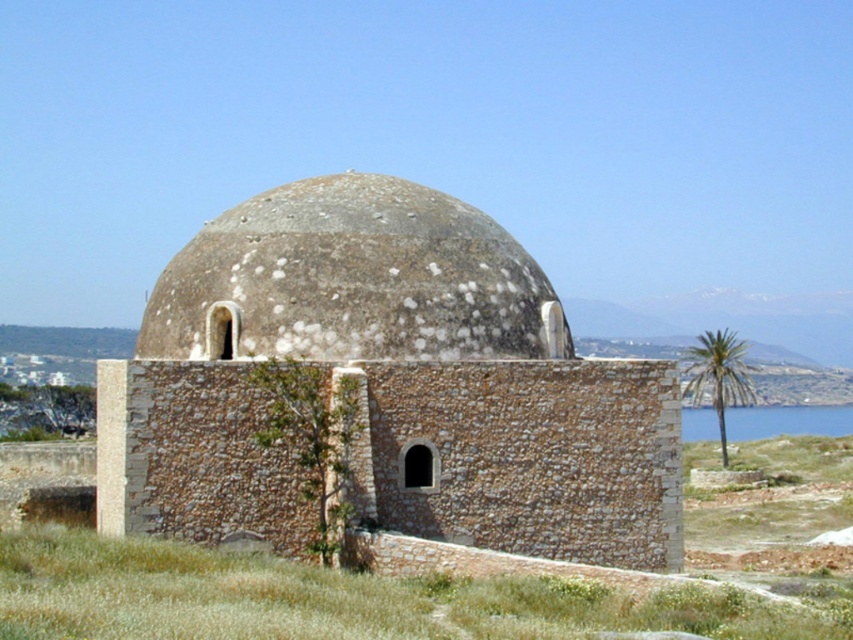
Who is more distant from viewer, (241, 493) or (453, 332)?

Point (453, 332)

The image size is (853, 640). Find the location of `brown stone dome at center`. brown stone dome at center is located at coordinates (387, 385).

Does point (444, 467) come in front of point (369, 182)?

Yes, point (444, 467) is closer to viewer.

Image resolution: width=853 pixels, height=640 pixels. In order to click on brown stone dome at center in this screenshot , I will do `click(387, 385)`.

The image size is (853, 640). Describe the element at coordinates (786, 420) in the screenshot. I see `blue water at right` at that location.

Can you confirm if blue water at right is thinner than green leafy palm at right?

No.

Is point (759, 417) positioned in front of point (688, 368)?

No, (759, 417) is further to viewer.

The image size is (853, 640). Find the location of `blue water at right`. blue water at right is located at coordinates (786, 420).

Is point (438, 250) behind point (709, 369)?

No.

Describe the element at coordinates (352, 280) in the screenshot. I see `speckled stone dome at center` at that location.

Does point (306, 269) come in front of point (743, 340)?

Yes, point (306, 269) is closer to viewer.

Find the location of `speckled stone dome at center`. speckled stone dome at center is located at coordinates (352, 280).